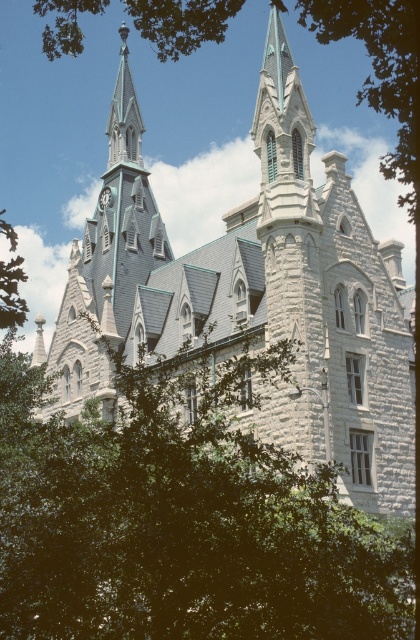
Which is above, green leafy tree at upper left or gray stone clock tower at center?

Positioned higher is green leafy tree at upper left.

Measure the distance between point (x=385, y=17) and camera.

A distance of 46.75 meters exists between point (x=385, y=17) and camera.

Who is more distant from viewer, (310,13) or (120,276)?

The point (120,276) is behind.

Image resolution: width=420 pixels, height=640 pixels. What are the coordinates of `green leafy tree at upper left` in the screenshot? It's located at (382, 74).

Does green leafy tree at lower left appear on the right side of gray stone clock tower at center?

Correct, you'll find green leafy tree at lower left to the right of gray stone clock tower at center.

Consider the image. Can you confirm if green leafy tree at lower left is positioned to the left of gray stone clock tower at center?

No, green leafy tree at lower left is not to the left of gray stone clock tower at center.

Between point (21, 454) and point (97, 268), which one is positioned in front?

Point (21, 454) is in front.

Where is `green leafy tree at lower left`? This screenshot has width=420, height=640. green leafy tree at lower left is located at coordinates (181, 518).

Is green leafy tree at lower left to the right of green leafy tree at upper left from the viewer's perspective?

No, green leafy tree at lower left is not to the right of green leafy tree at upper left.

Is green leafy tree at lower left closer to camera compared to green leafy tree at upper left?

Yes, it is in front of green leafy tree at upper left.

Between point (65, 557) and point (217, 10), which one is positioned behind?

The point (217, 10) is behind.

Identify the location of green leafy tree at lower left. (181, 518).